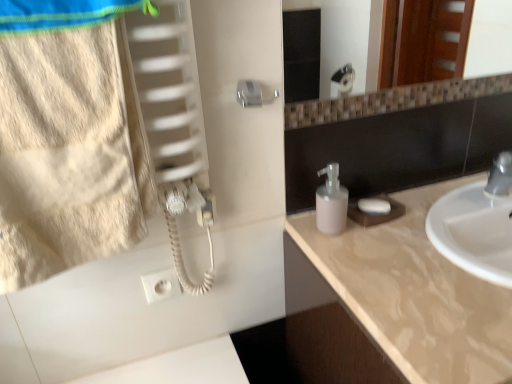
Question: From the image's perspective, is beige cotton towel at left positioned above or below white matte soap at right?

Choices:
 (A) below
 (B) above

Answer: (B)

Question: Considering the relative positions of beige cotton towel at left and white matte soap at right in the image provided, is beige cotton towel at left to the left or to the right of white matte soap at right?

Choices:
 (A) right
 (B) left

Answer: (B)

Question: Which object is positioned closest to the white matte soap at right?

Choices:
 (A) pink matte soap dispenser at center
 (B) beige cotton towel at left
 (C) beige marble countertop at right

Answer: (A)

Question: Based on their relative distances, which object is nearer to the pink matte soap dispenser at center?

Choices:
 (A) white matte soap at right
 (B) beige cotton towel at left
 (C) beige marble countertop at right

Answer: (A)